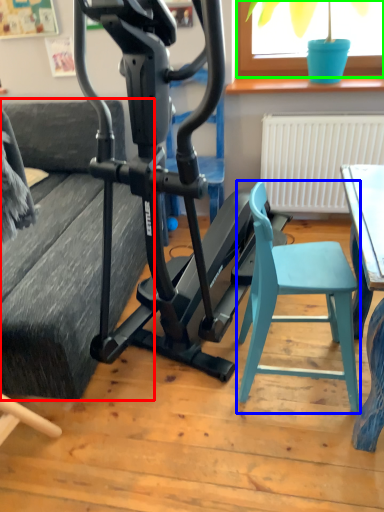
Question: Based on their relative distances, which object is farther from couch (highlighted by a red box)? Choose from folding chair (highlighted by a blue box) and window screen (highlighted by a green box).

Choices:
 (A) folding chair
 (B) window screen

Answer: (B)